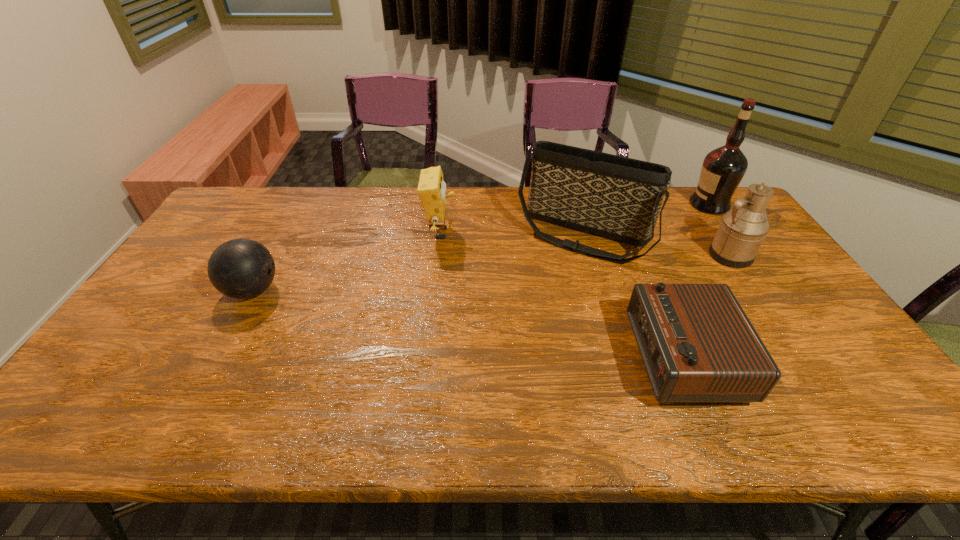
Identify which object is the fifth closest to the fifth object from right to left. Please provide its 2D coordinates. Your answer should be formatted as a tuple, i.e. [(x, y)], where the tuple contains the x and y coordinates of a point satisfying the conditions above.

[(722, 170)]

Find the location of `free space in the image that satisfies the following two spatial constraints: 1. on the face of the handbag; 2. on the left side of the fifth object from right to left`. free space in the image that satisfies the following two spatial constraints: 1. on the face of the handbag; 2. on the left side of the fifth object from right to left is located at coordinates (440, 235).

Identify the location of vacant point that satisfies the following two spatial constraints: 1. on the face of the second object from left to right; 2. on the right side of the pitcher. (438, 255).

In order to click on free space that satisfies the following two spatial constraints: 1. on the front side of the pitcher; 2. on the tuning display of the nearest object in this screenshot , I will do `click(797, 357)`.

You are a GUI agent. You are given a task and a screenshot of the screen. Output one action in this format:
    pyautogui.click(x=<x>, y=<y>)
    Task: Click on the vacant space that satisfies the following two spatial constraints: 1. on the face of the pitcher; 2. on the right side of the fourth tallest object
    This screenshot has height=540, width=960.
    Given the screenshot: What is the action you would take?
    pyautogui.click(x=438, y=255)